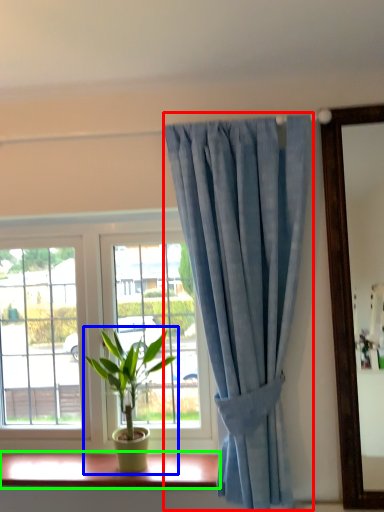
Question: Estimate the real-world distances between objects in this image. Which object is closer to curtain (highlighted by a red box), houseplant (highlighted by a blue box) or window sill (highlighted by a green box)?

Choices:
 (A) houseplant
 (B) window sill

Answer: (A)